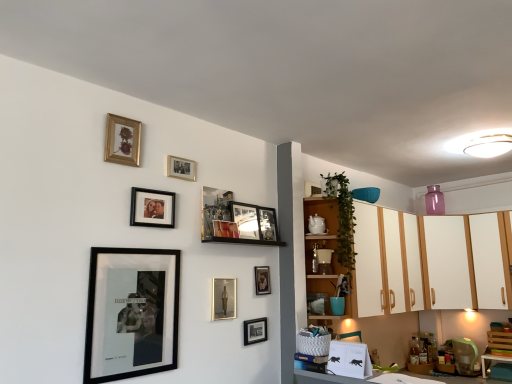
Question: Can you confirm if green leafy plant at upper right is shorter than white glossy cabinets at upper right, which is the second cabinetry from left to right?

Choices:
 (A) yes
 (B) no

Answer: (A)

Question: Does green leafy plant at upper right have a larger size compared to white glossy cabinets at upper right, which ranks as the 2th cabinetry in right-to-left order?

Choices:
 (A) no
 (B) yes

Answer: (A)

Question: From a real-world perspective, does green leafy plant at upper right stand above white glossy cabinets at upper right, which ranks as the 2th cabinetry in right-to-left order?

Choices:
 (A) no
 (B) yes

Answer: (B)

Question: Is green leafy plant at upper right further to the viewer compared to white glossy cabinets at upper right, which ranks as the 2th cabinetry in right-to-left order?

Choices:
 (A) no
 (B) yes

Answer: (A)

Question: Is green leafy plant at upper right in front of white glossy cabinets at upper right, which is the second cabinetry from left to right?

Choices:
 (A) no
 (B) yes

Answer: (B)

Question: From a real-world perspective, is green leafy plant at upper right positioned under white glossy cabinets at upper right, which is the second cabinetry from left to right, based on gravity?

Choices:
 (A) no
 (B) yes

Answer: (A)

Question: From a real-world perspective, is white glossy cabinets at upper right, which ranks as the 2th cabinetry in right-to-left order, on metallic silver portrait at center, the second picture frame in the bottom-to-top sequence?

Choices:
 (A) yes
 (B) no

Answer: (A)

Question: Is metallic silver portrait at center, marked as the tenth picture frame in a top-to-bottom arrangement, located within white glossy cabinets at upper right, which is the second cabinetry from left to right?

Choices:
 (A) no
 (B) yes

Answer: (A)

Question: Is white glossy cabinets at upper right, which ranks as the 2th cabinetry in right-to-left order, not close to metallic silver portrait at center, marked as the tenth picture frame in a top-to-bottom arrangement?

Choices:
 (A) yes
 (B) no

Answer: (A)

Question: Is white glossy cabinets at upper right, which ranks as the 2th cabinetry in right-to-left order, beside metallic silver portrait at center, marked as the tenth picture frame in a top-to-bottom arrangement?

Choices:
 (A) no
 (B) yes

Answer: (A)

Question: Considering the relative positions of white glossy cabinets at upper right, which ranks as the 2th cabinetry in right-to-left order, and metallic silver portrait at center, marked as the tenth picture frame in a top-to-bottom arrangement, in the image provided, is white glossy cabinets at upper right, which ranks as the 2th cabinetry in right-to-left order, to the right of metallic silver portrait at center, marked as the tenth picture frame in a top-to-bottom arrangement, from the viewer's perspective?

Choices:
 (A) no
 (B) yes

Answer: (B)

Question: Considering the relative sizes of white glossy cabinets at upper right, which ranks as the 2th cabinetry in right-to-left order, and metallic silver portrait at center, the second picture frame in the bottom-to-top sequence, in the image provided, is white glossy cabinets at upper right, which ranks as the 2th cabinetry in right-to-left order, bigger than metallic silver portrait at center, the second picture frame in the bottom-to-top sequence,?

Choices:
 (A) yes
 (B) no

Answer: (A)

Question: Are wooden cabinet at upper right and black matte picture frame at lower center, the 1th picture frame ordered from the bottom, far apart?

Choices:
 (A) yes
 (B) no

Answer: (B)